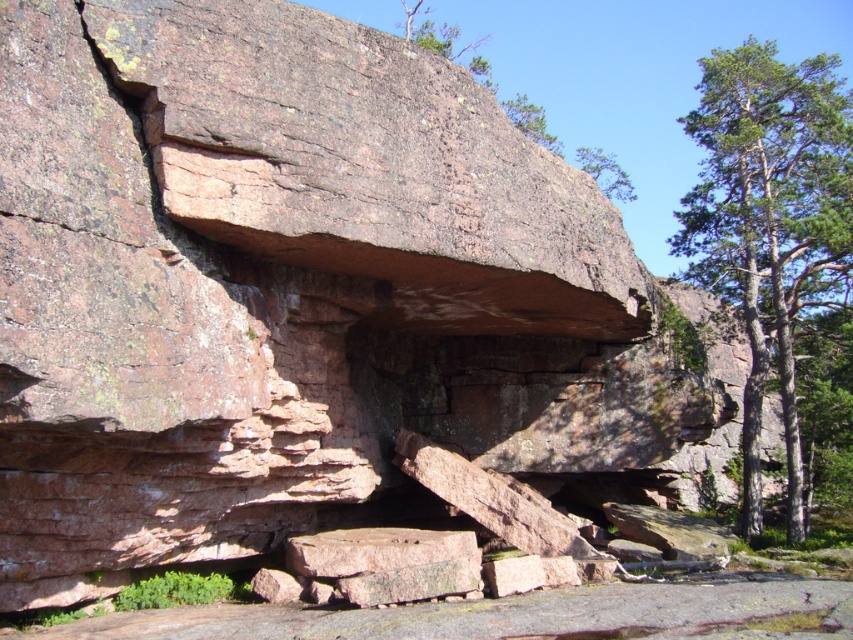
Question: Can you confirm if green textured tree at right is bigger than green leafy tree at upper center?

Choices:
 (A) yes
 (B) no

Answer: (A)

Question: Is green textured tree at right in front of green leafy tree at upper center?

Choices:
 (A) yes
 (B) no

Answer: (B)

Question: Can you confirm if green textured tree at right is positioned to the left of green leafy tree at upper center?

Choices:
 (A) no
 (B) yes

Answer: (A)

Question: Which of the following is the farthest from the observer?

Choices:
 (A) green textured tree at right
 (B) green leafy tree at upper center

Answer: (A)

Question: Which point is farther to the camera?

Choices:
 (A) (537, 131)
 (B) (751, 349)

Answer: (A)

Question: Among these points, which one is nearest to the camera?

Choices:
 (A) (766, 250)
 (B) (596, 170)

Answer: (A)